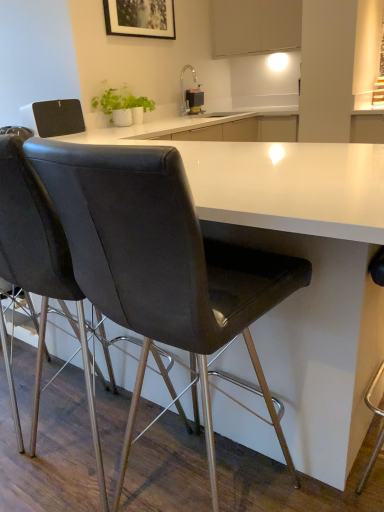
What do you see at coordinates (122, 106) in the screenshot?
I see `white textured vase at upper center` at bounding box center [122, 106].

Identify the location of white matte cabinet at upper center. The image size is (384, 512). (255, 26).

In order to click on matte black chair at center, the first chair positioned from the left in this screenshot , I will do `click(40, 254)`.

From the image's perspective, relative to white matte cabinet at upper center, is metallic black soap dispenser at upper center above or below?

Based on their image positions, metallic black soap dispenser at upper center is located beneath white matte cabinet at upper center.

Between point (198, 111) and point (283, 18), which one is positioned in front?

Point (283, 18)

Which object is more forward, metallic black soap dispenser at upper center or white matte cabinet at upper center?

white matte cabinet at upper center.

From a real-world perspective, is metallic black soap dispenser at upper center located beneath white matte cabinet at upper center?

Correct, in the physical world, metallic black soap dispenser at upper center is lower than white matte cabinet at upper center.

Consider the image. Considering the relative sizes of matte black picture frame at upper center and white textured vase at upper center in the image provided, is matte black picture frame at upper center taller than white textured vase at upper center?

Indeed, matte black picture frame at upper center has a greater height compared to white textured vase at upper center.

From a real-world perspective, which is physically above, matte black picture frame at upper center or white textured vase at upper center?

matte black picture frame at upper center, from a real-world perspective.

Can you tell me how much matte black picture frame at upper center and white textured vase at upper center differ in facing direction?

They differ by 1.31 degrees in their facing directions.

Is matte black picture frame at upper center positioned beyond the bounds of white textured vase at upper center?

Indeed, matte black picture frame at upper center is completely outside white textured vase at upper center.

Based on the photo, visually, is white textured vase at upper center positioned to the left or to the right of matte black chair at center, the 1th chair positioned from the right?

white textured vase at upper center is to the left of matte black chair at center, the 1th chair positioned from the right.

From the image's perspective, is white textured vase at upper center below matte black chair at center, the 2th chair from the left?

No, from the image's perspective, white textured vase at upper center is not below matte black chair at center, the 2th chair from the left.

Consider the image. Is white textured vase at upper center in front of matte black chair at center, the 2th chair from the left?

No, the depth of white textured vase at upper center is greater than that of matte black chair at center, the 2th chair from the left.

Is white textured vase at upper center in contact with matte black chair at center, the 2th chair from the left?

No.

Could you tell me if white matte cabinet at upper center is facing matte black picture frame at upper center?

Yes, white matte cabinet at upper center is oriented towards matte black picture frame at upper center.

Can you tell me how much white matte cabinet at upper center and matte black picture frame at upper center differ in facing direction?

The facing directions of white matte cabinet at upper center and matte black picture frame at upper center are 89.4 degrees apart.

Does white matte cabinet at upper center have a lesser height compared to matte black picture frame at upper center?

Incorrect, the height of white matte cabinet at upper center does not fall short of that of matte black picture frame at upper center.

Can you confirm if metallic black soap dispenser at upper center is bigger than matte black chair at center, the 2th chair from the left?

No, metallic black soap dispenser at upper center is not bigger than matte black chair at center, the 2th chair from the left.

In terms of width, does metallic black soap dispenser at upper center look wider or thinner when compared to matte black chair at center, the 1th chair positioned from the right?

Clearly, metallic black soap dispenser at upper center has less width compared to matte black chair at center, the 1th chair positioned from the right.

How many degrees apart are the facing directions of metallic black soap dispenser at upper center and matte black chair at center, the 2th chair from the left?

They differ by 89.2 degrees in their facing directions.

Which of these two, metallic black soap dispenser at upper center or matte black chair at center, the 2th chair from the left, stands shorter?

Standing shorter between the two is metallic black soap dispenser at upper center.

Does matte black chair at center, the 2th chair from the right, appear on the right side of white matte cabinet at upper center?

Incorrect, matte black chair at center, the 2th chair from the right, is not on the right side of white matte cabinet at upper center.

Is matte black chair at center, the first chair positioned from the left, touching white matte cabinet at upper center?

matte black chair at center, the first chair positioned from the left, and white matte cabinet at upper center are clearly separated.

Does matte black chair at center, the 2th chair from the right, contain white matte cabinet at upper center?

No, white matte cabinet at upper center is not inside matte black chair at center, the 2th chair from the right.

From a real-world perspective, who is located higher, matte black chair at center, the 2th chair from the right, or white matte cabinet at upper center?

white matte cabinet at upper center.

Between matte black chair at center, the 2th chair from the left, and matte black picture frame at upper center, which one has larger width?

matte black chair at center, the 2th chair from the left.

Would you say matte black chair at center, the 2th chair from the left, contains matte black picture frame at upper center?

No, matte black picture frame at upper center is located outside of matte black chair at center, the 2th chair from the left.

From the image's perspective, is matte black chair at center, the 2th chair from the left, located above or below matte black picture frame at upper center?

matte black chair at center, the 2th chair from the left, is situated lower than matte black picture frame at upper center in the image.

Is matte black chair at center, the 2th chair from the left, taller or shorter than matte black picture frame at upper center?

matte black chair at center, the 2th chair from the left, is taller than matte black picture frame at upper center.

The width and height of the screenshot is (384, 512). I want to click on cabinetry lying above the metallic black soap dispenser at upper center (from the image's perspective), so click(x=255, y=26).

This screenshot has height=512, width=384. I want to click on picture frame located above the white textured vase at upper center (from a real-world perspective), so click(x=140, y=18).

Which object lies nearer to the anchor point white textured vase at upper center, white matte cabinet at upper center or matte black chair at center, the 2th chair from the left?

white matte cabinet at upper center is positioned closer to the anchor white textured vase at upper center.

Based on their spatial positions, is white textured vase at upper center or matte black picture frame at upper center further from matte black chair at center, the 2th chair from the right?

Among the two, matte black picture frame at upper center is located further to matte black chair at center, the 2th chair from the right.

Which object lies nearer to the anchor point metallic black soap dispenser at upper center, white matte cabinet at upper center or matte black chair at center, the first chair positioned from the left?

The object closer to metallic black soap dispenser at upper center is white matte cabinet at upper center.

Based on their spatial positions, is matte black chair at center, the 2th chair from the right, or matte black chair at center, the 2th chair from the left, further from matte black picture frame at upper center?

matte black chair at center, the 2th chair from the left, is positioned further to the anchor matte black picture frame at upper center.

Looking at this image, from the image, which object appears to be farther from white textured vase at upper center, white matte cabinet at upper center or metallic black soap dispenser at upper center?

Among the two, white matte cabinet at upper center is located further to white textured vase at upper center.

Looking at the image, which one is located further to metallic black soap dispenser at upper center, white matte cabinet at upper center or matte black chair at center, the 2th chair from the left?

matte black chair at center, the 2th chair from the left, is positioned further to the anchor metallic black soap dispenser at upper center.

Looking at the image, which one is located closer to white textured vase at upper center, metallic black soap dispenser at upper center or matte black picture frame at upper center?

matte black picture frame at upper center.

Considering their positions, is matte black chair at center, the 1th chair positioned from the right, positioned further to white matte cabinet at upper center than matte black picture frame at upper center?

matte black chair at center, the 1th chair positioned from the right.

At what (x,y) coordinates should I click in order to perform the action: click on houseplant between matte black chair at center, the 2th chair from the right, and matte black picture frame at upper center, along the z-axis. Please return your answer as a coordinate pair (x, y). This screenshot has width=384, height=512. Looking at the image, I should click on (122, 106).

This screenshot has height=512, width=384. What are the coordinates of `cabinetry between matte black chair at center, the 2th chair from the left, and metallic black soap dispenser at upper center, along the z-axis` in the screenshot? It's located at (255, 26).

Identify the location of cabinetry between matte black chair at center, the first chair positioned from the left, and metallic black soap dispenser at upper center from front to back. Image resolution: width=384 pixels, height=512 pixels. (255, 26).

You are a GUI agent. You are given a task and a screenshot of the screen. Output one action in this format:
    pyautogui.click(x=<x>, y=<y>)
    Task: Click on the picture frame positioned between white textured vase at upper center and metallic black soap dispenser at upper center from near to far
    The width and height of the screenshot is (384, 512).
    Given the screenshot: What is the action you would take?
    pyautogui.click(x=140, y=18)